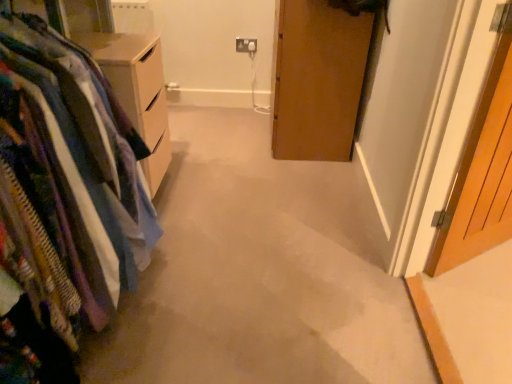
Question: Is wooden door at right smaller than textured fabric closet at left?

Choices:
 (A) no
 (B) yes

Answer: (B)

Question: Can you confirm if wooden door at right is shorter than textured fabric closet at left?

Choices:
 (A) yes
 (B) no

Answer: (B)

Question: From the image's perspective, is wooden door at right over textured fabric closet at left?

Choices:
 (A) no
 (B) yes

Answer: (B)

Question: Is wooden door at right placed right next to textured fabric closet at left?

Choices:
 (A) no
 (B) yes

Answer: (A)

Question: Is wooden door at right further to the viewer compared to textured fabric closet at left?

Choices:
 (A) yes
 (B) no

Answer: (A)

Question: Is textured fabric closet at left at the back of wooden door at right?

Choices:
 (A) no
 (B) yes

Answer: (A)

Question: Is textured fabric closet at left turned away from wooden door at right?

Choices:
 (A) no
 (B) yes

Answer: (A)

Question: From the image's perspective, is textured fabric closet at left beneath wooden door at right?

Choices:
 (A) no
 (B) yes

Answer: (B)

Question: Considering the relative sizes of textured fabric closet at left and wooden door at right in the image provided, is textured fabric closet at left smaller than wooden door at right?

Choices:
 (A) yes
 (B) no

Answer: (B)

Question: Can you confirm if textured fabric closet at left is bigger than wooden door at right?

Choices:
 (A) yes
 (B) no

Answer: (A)

Question: Can you confirm if textured fabric closet at left is shorter than wooden door at right?

Choices:
 (A) yes
 (B) no

Answer: (A)

Question: Considering the relative sizes of textured fabric closet at left and wooden door at right in the image provided, is textured fabric closet at left thinner than wooden door at right?

Choices:
 (A) yes
 (B) no

Answer: (B)

Question: From the image's perspective, does wooden door at right appear higher than white plastic electric outlet at upper center?

Choices:
 (A) no
 (B) yes

Answer: (A)